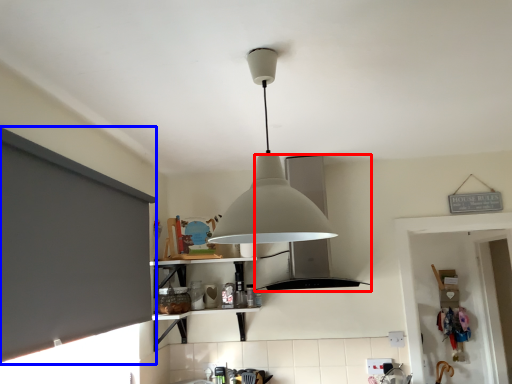
Question: Among these objects, which one is nearest to the camera, vent (highlighted by a red box) or window screen (highlighted by a blue box)?

Choices:
 (A) vent
 (B) window screen

Answer: (B)